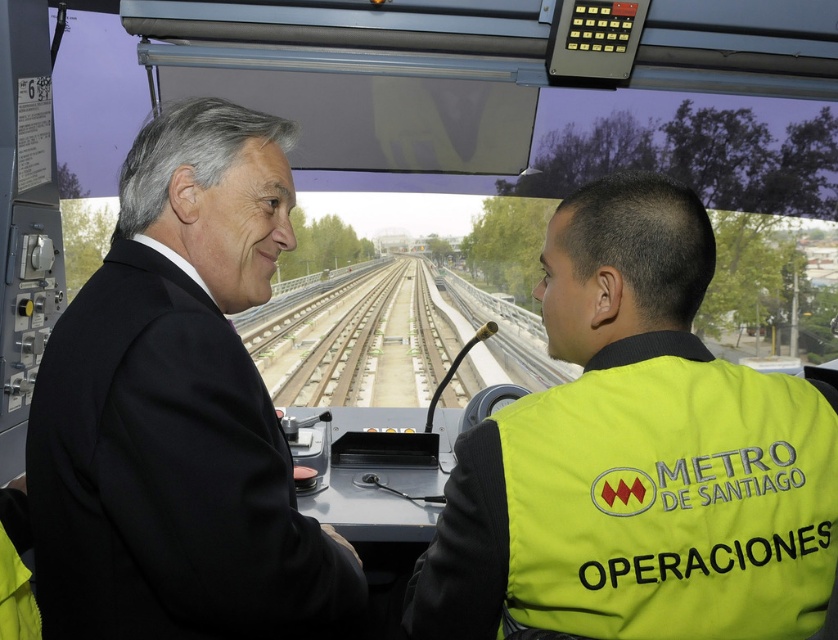
You are a visitor standing in the train control cabin. You see the black suit at left and the yellow reflective fabric safety vest at center. Which object is taller?

The black suit at left is much taller than the yellow reflective fabric safety vest at center.

You are a passenger standing at point (376, 307) and want to reach point (670, 532). Based on the control cabin layout, which direction should you move to get there?

Point (670, 532) is in front of point (376, 307), so you should move forward to reach it.